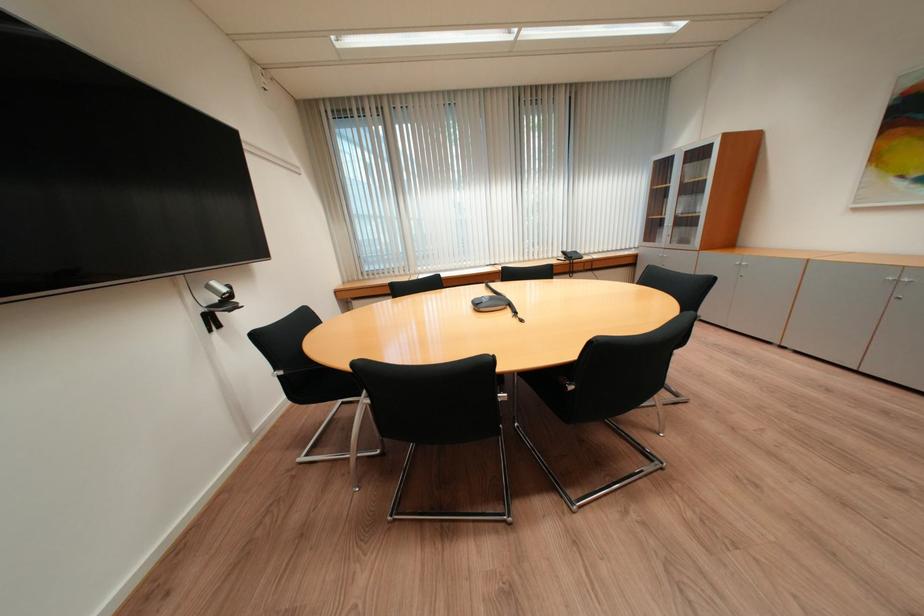
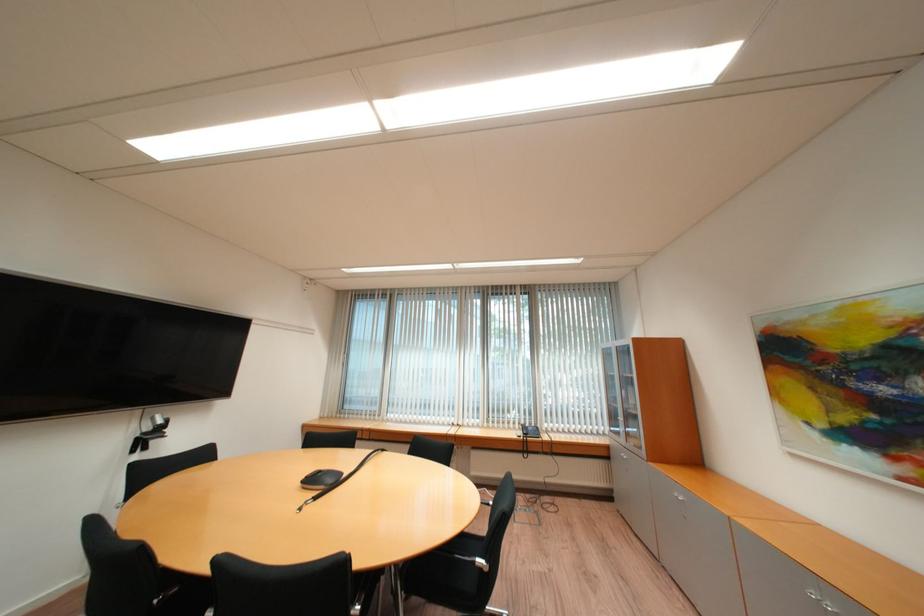
In the second image, find the point that corresponds to point 217,289 in the first image.

(162, 419)